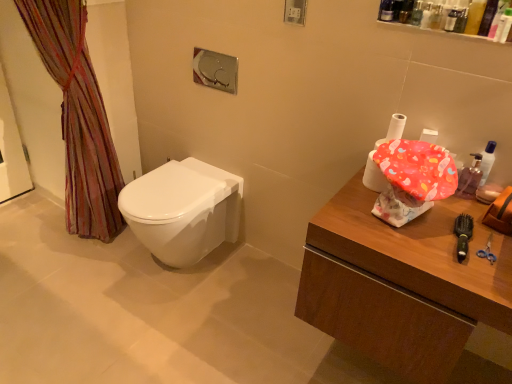
Question: Are white glossy toilet at center and green plastic brush at right located far from each other?

Choices:
 (A) yes
 (B) no

Answer: (A)

Question: Is white glossy toilet at center taller than green plastic brush at right?

Choices:
 (A) no
 (B) yes

Answer: (B)

Question: Is white glossy toilet at center oriented away from green plastic brush at right?

Choices:
 (A) yes
 (B) no

Answer: (B)

Question: Is white glossy toilet at center to the left of green plastic brush at right from the viewer's perspective?

Choices:
 (A) yes
 (B) no

Answer: (A)

Question: Does white glossy toilet at center have a smaller size compared to green plastic brush at right?

Choices:
 (A) yes
 (B) no

Answer: (B)

Question: In terms of width, does translucent plastic mouthwash at upper right, which appears as the second mouthwash when viewed from the front, look wider or thinner when compared to wooden counter at right?

Choices:
 (A) thin
 (B) wide

Answer: (A)

Question: In terms of height, does translucent plastic mouthwash at upper right, which appears as the first mouthwash when ordered from the bottom, look taller or shorter compared to wooden counter at right?

Choices:
 (A) short
 (B) tall

Answer: (A)

Question: Is translucent plastic mouthwash at upper right, which appears as the first mouthwash when ordered from the bottom, to the left or to the right of wooden counter at right in the image?

Choices:
 (A) left
 (B) right

Answer: (B)

Question: Which is correct: translucent plastic mouthwash at upper right, which appears as the first mouthwash when ordered from the bottom, is inside wooden counter at right, or outside of it?

Choices:
 (A) inside
 (B) outside

Answer: (B)

Question: From a real-world perspective, is multicolored fabric curtain at left physically located above or below translucent plastic container at upper right, which is the 1th toiletry from right to left?

Choices:
 (A) above
 (B) below

Answer: (B)

Question: From their relative heights in the image, would you say multicolored fabric curtain at left is taller or shorter than translucent plastic container at upper right, which ranks as the 2th toiletry in left-to-right order?

Choices:
 (A) short
 (B) tall

Answer: (B)

Question: Is point (97, 102) positioned closer to the camera than point (401, 11)?

Choices:
 (A) closer
 (B) farther

Answer: (B)

Question: Is multicolored fabric curtain at left in front of or behind translucent plastic container at upper right, which ranks as the 2th toiletry in left-to-right order, in the image?

Choices:
 (A) front
 (B) behind

Answer: (B)

Question: Considering the positions of multicolored fabric curtain at left and translucent plastic mouthwash at upper right, which appears as the first mouthwash when ordered from the bottom, in the image, is multicolored fabric curtain at left taller or shorter than translucent plastic mouthwash at upper right, which appears as the first mouthwash when ordered from the bottom,?

Choices:
 (A) short
 (B) tall

Answer: (B)

Question: Considering the positions of point (40, 1) and point (467, 170), is point (40, 1) closer or farther from the camera than point (467, 170)?

Choices:
 (A) closer
 (B) farther

Answer: (B)